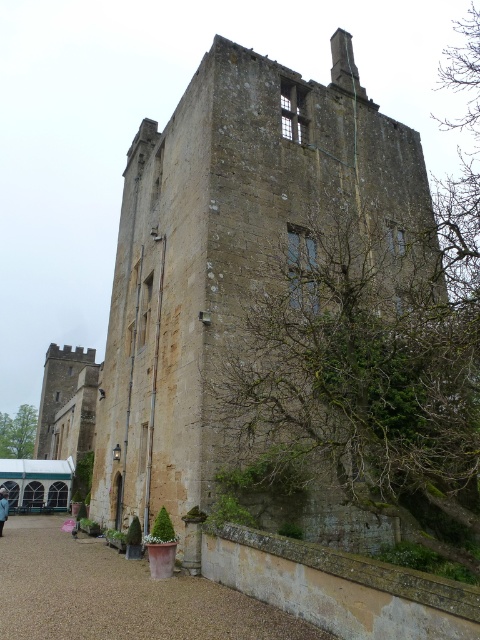
Does point (259, 192) come in front of point (84, 536)?

Yes, it is.

Find the location of a particular element. The width and height of the screenshot is (480, 640). brown stone castle at center is located at coordinates pyautogui.click(x=213, y=266).